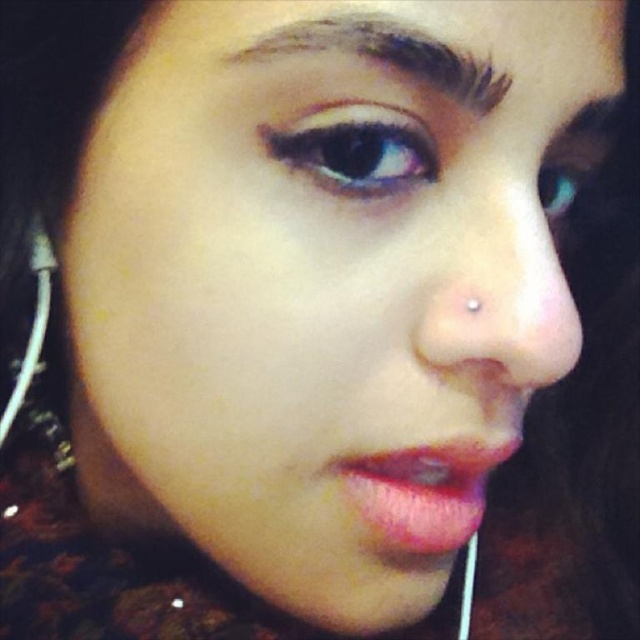
Can you confirm if smooth flesh nose at center is shorter than pink glossy lips at center?

Incorrect, smooth flesh nose at center's height does not fall short of pink glossy lips at center's.

Is smooth flesh nose at center taller than pink glossy lips at center?

Yes.

The height and width of the screenshot is (640, 640). What do you see at coordinates (509, 300) in the screenshot?
I see `smooth flesh nose at center` at bounding box center [509, 300].

Where is `smooth flesh nose at center`? smooth flesh nose at center is located at coordinates (509, 300).

Who is more forward, (372, 522) or (314, 170)?

Point (314, 170) is in front.

Where is `pink glossy lips at center`? pink glossy lips at center is located at coordinates (422, 492).

Which is in front, point (358, 470) or point (401, 138)?

Point (401, 138)

At what (x,y) coordinates should I click in order to perform the action: click on pink glossy lips at center. Please return your answer as a coordinate pair (x, y). Looking at the image, I should click on (422, 492).

Who is higher up, smooth flesh nose at center or dark brown hair at upper center?

dark brown hair at upper center

Based on the photo, who is shorter, smooth flesh nose at center or dark brown hair at upper center?

dark brown hair at upper center

Is point (470, 260) less distant than point (376, 48)?

No, it is not.

You are a GUI agent. You are given a task and a screenshot of the screen. Output one action in this format:
    pyautogui.click(x=<x>, y=<y>)
    Task: Click on the smooth flesh nose at center
    This screenshot has width=640, height=640.
    Given the screenshot: What is the action you would take?
    pyautogui.click(x=509, y=300)